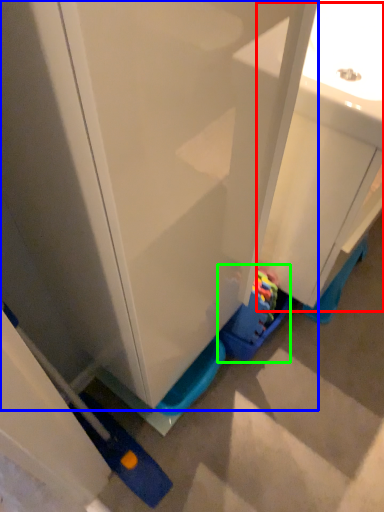
Question: Which object is positioned closest to sink (highlighted by a red box)? Select from cabinetry (highlighted by a blue box) and toy (highlighted by a green box).

Choices:
 (A) cabinetry
 (B) toy

Answer: (A)